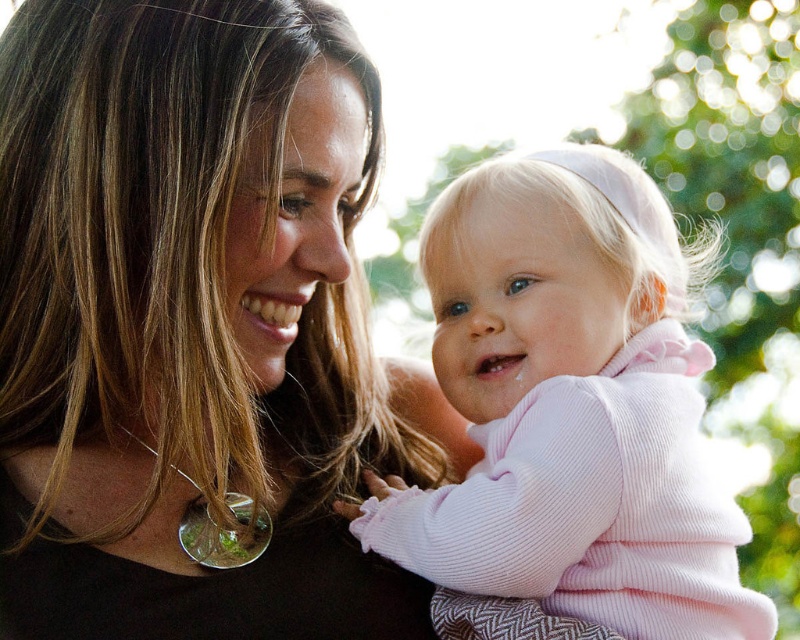
Question: Which point appears closest to the camera in this image?

Choices:
 (A) (622, 294)
 (B) (40, 1)

Answer: (B)

Question: Which of the following is the farthest from the observer?

Choices:
 (A) (562, 188)
 (B) (326, 266)

Answer: (A)

Question: In this image, where is matte black shirt at center located relative to pink corduroy baby at center?

Choices:
 (A) left
 (B) right

Answer: (A)

Question: Can you confirm if matte black shirt at center is thinner than pink corduroy baby at center?

Choices:
 (A) yes
 (B) no

Answer: (B)

Question: Is matte black shirt at center to the right of pink corduroy baby at center from the viewer's perspective?

Choices:
 (A) no
 (B) yes

Answer: (A)